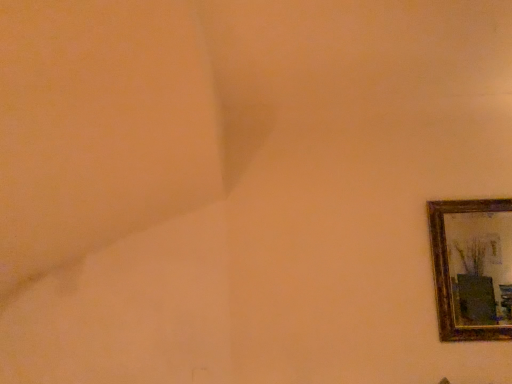
Question: Should I look upward or downward to see gold-framed mirror at right?

Choices:
 (A) down
 (B) up

Answer: (A)